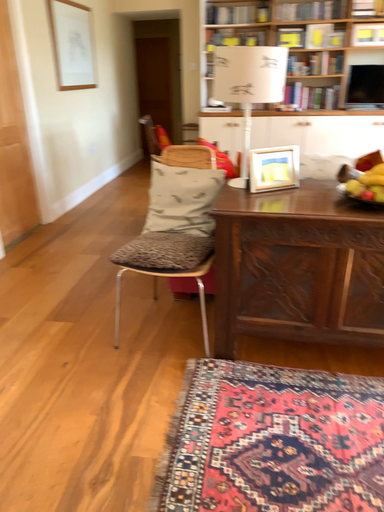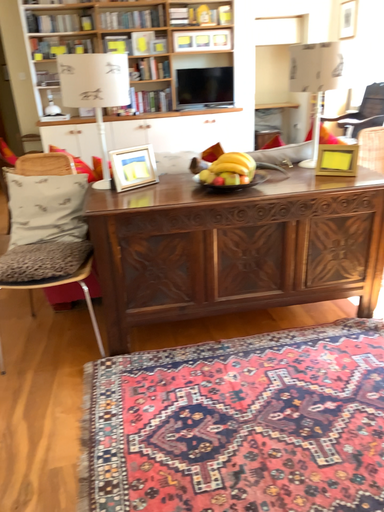
Question: How did the camera likely rotate when shooting the video?

Choices:
 (A) rotated right
 (B) rotated left

Answer: (A)